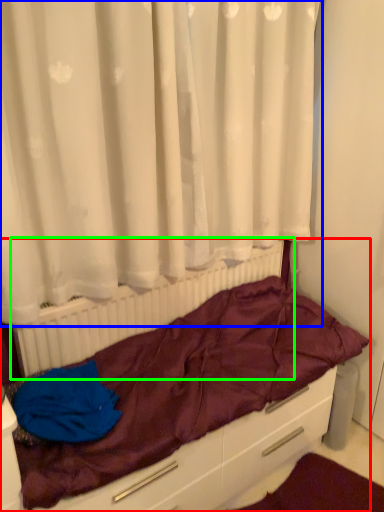
Question: Estimate the real-world distances between objects in this image. Which object is closer to furniture (highlighted by a red box), curtain (highlighted by a blue box) or radiator (highlighted by a green box)?

Choices:
 (A) curtain
 (B) radiator

Answer: (B)